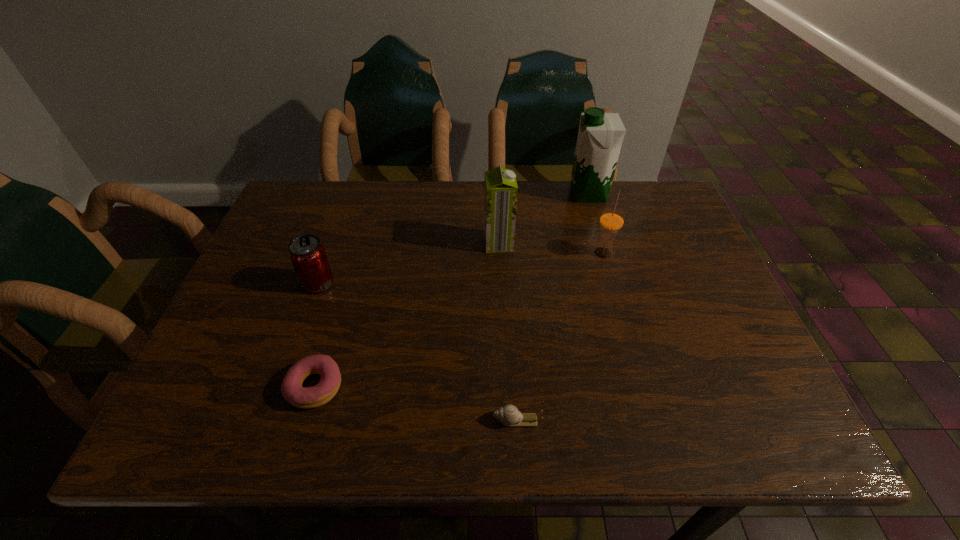
At what (x,y) coordinates should I click in order to perform the action: click on doughnut at the near edge. Please return your answer as a coordinate pair (x, y). Image resolution: width=960 pixels, height=540 pixels. Looking at the image, I should click on tap(302, 397).

Where is `escargot that is at the near edge`? The width and height of the screenshot is (960, 540). escargot that is at the near edge is located at coordinates (508, 415).

The height and width of the screenshot is (540, 960). In order to click on object at the left edge in this screenshot , I will do point(308,256).

This screenshot has width=960, height=540. I want to click on free space at the far edge, so click(542, 196).

Find the location of a particular element. Image resolution: width=960 pixels, height=540 pixels. free spot at the near edge of the desktop is located at coordinates (444, 429).

Identify the location of free location at the right edge of the desktop. The height and width of the screenshot is (540, 960). (667, 251).

Find the location of `free region at the far left corner of the desktop`. free region at the far left corner of the desktop is located at coordinates (328, 208).

At what (x,y) coordinates should I click in order to perform the action: click on free region at the near left corner. Please return your answer as a coordinate pair (x, y). The height and width of the screenshot is (540, 960). Looking at the image, I should click on point(187,415).

In the image, there is a desktop. What are the coordinates of `blank space at the near right corner` in the screenshot? It's located at (754, 443).

Find the location of a particular element. The width and height of the screenshot is (960, 540). vacant point located between the escargot and the straw is located at coordinates (560, 336).